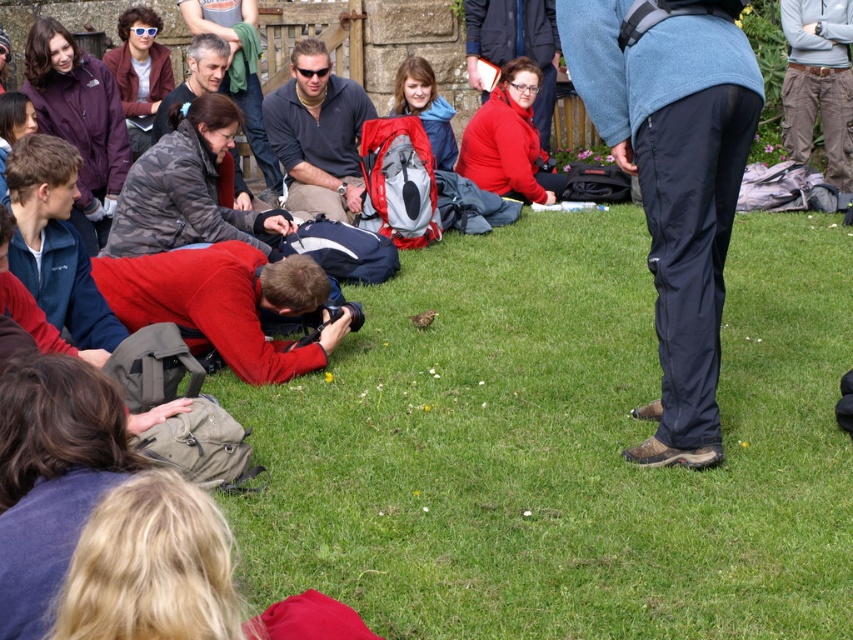
You are standing at the origin point of the coordinate system in the image. You want to take a photo of the green grass at center. In which direction should you move to reach it?

Answer: The green grass at center is located at coordinate point 0.697 on the x axis and 0.660 on the y axis, so you should move towards the right and slightly downward from your current position at the origin to reach it.

You are a photographer trying to capture a clear shot of the matte red jacket at center without the green grass at center blocking the view. Is it possible to do so from your current position?

The green grass at center is in front of the matte red jacket at center, so it is blocking the view. To capture a clear shot of the matte red jacket at center, you would need to adjust your position to move around the green grass at center or use a different angle to avoid the obstruction.